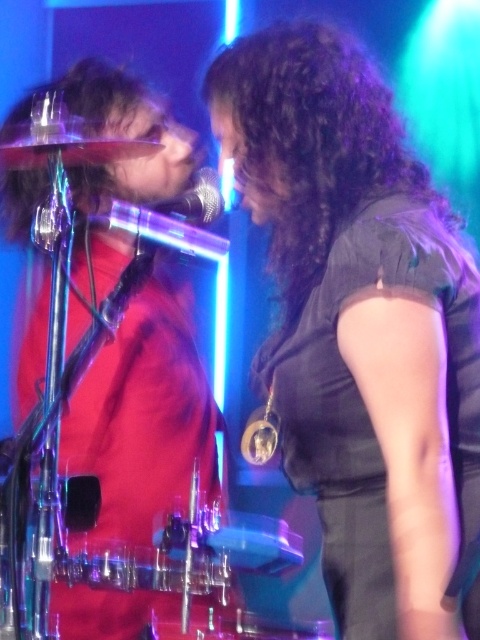
Based on the scene description, where exactly is the black matte dress at center located in the image?

The black matte dress at center is located at point [360,323].

You are a costume designer preparing for a performance. You need to ensure that the hemlines of the black matte dress at center and the red matte shirt at left are appropriate for the stage. Based on the description, which garment has a shorter hemline?

The black matte dress at center has a shorter hemline than the red matte shirt at left, as stated in the description.